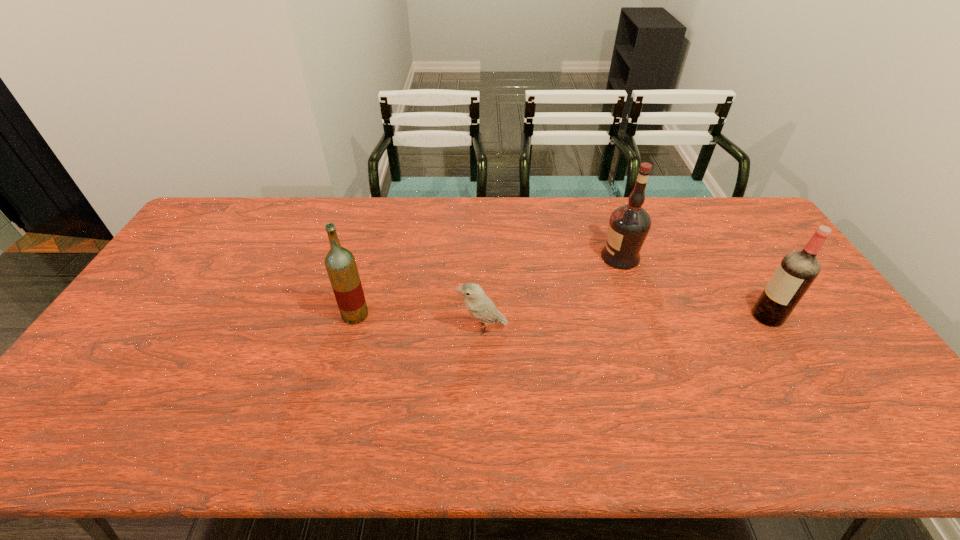
The image size is (960, 540). What are the coordinates of `the second liquor from right to left` in the screenshot? It's located at (629, 225).

Where is `the second object from right to left`? Image resolution: width=960 pixels, height=540 pixels. the second object from right to left is located at coordinates (629, 225).

Where is `the leftmost object`? This screenshot has width=960, height=540. the leftmost object is located at coordinates (340, 263).

I want to click on the rightmost object, so click(x=797, y=271).

Identify the location of bird. This screenshot has width=960, height=540. coord(479,305).

Identify the location of the shortest object. (479, 305).

Where is `free space located on the surface of the third object from left to right`? The width and height of the screenshot is (960, 540). free space located on the surface of the third object from left to right is located at coordinates (503, 258).

Find the location of a particular element. The image size is (960, 540). blank area located 0.330m on the surface of the third object from left to right is located at coordinates (499, 258).

Where is `vacant space located on the surface of the third object from left to right`? vacant space located on the surface of the third object from left to right is located at coordinates (537, 258).

You are a GUI agent. You are given a task and a screenshot of the screen. Output one action in this format:
    pyautogui.click(x=<x>, y=<y>)
    Task: Click on the free space located on the left of the leftmost object
    
    Given the screenshot: What is the action you would take?
    (205, 315)